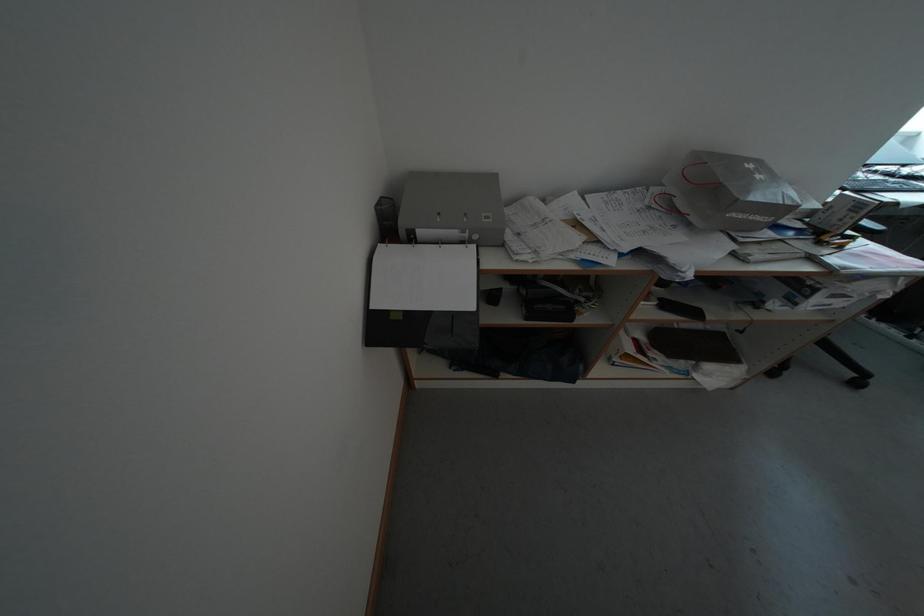
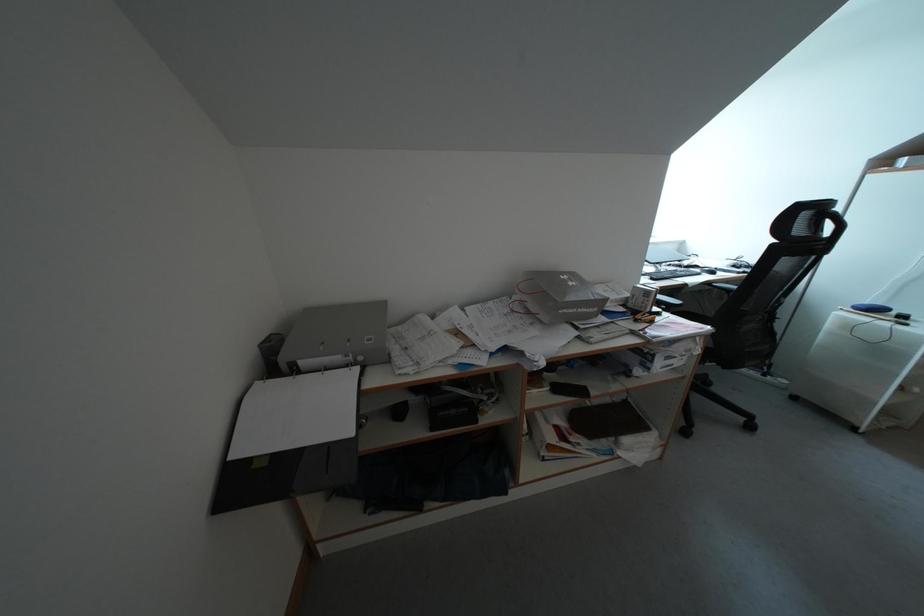
The images are taken continuously from a first-person perspective. In which direction are you moving?

The cameraman walked toward right, backward.